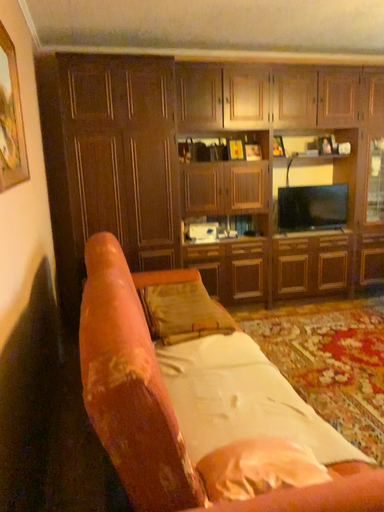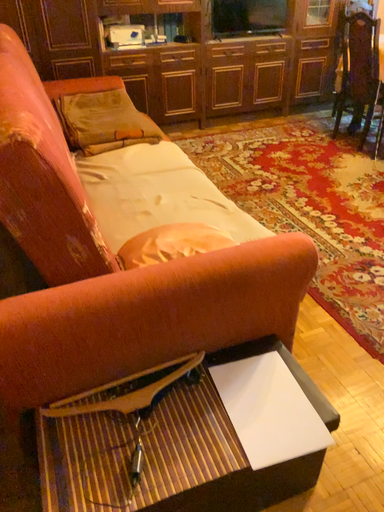
Question: Which way did the camera rotate in the video?

Choices:
 (A) rotated downward
 (B) rotated upward

Answer: (A)